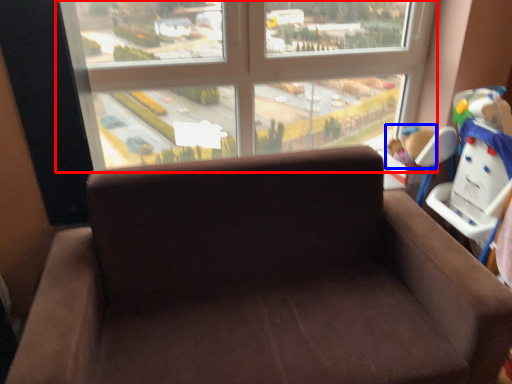
Question: Which of the following is the closest to the observer, window (highlighted by a red box) or child (highlighted by a blue box)?

Choices:
 (A) window
 (B) child

Answer: (A)